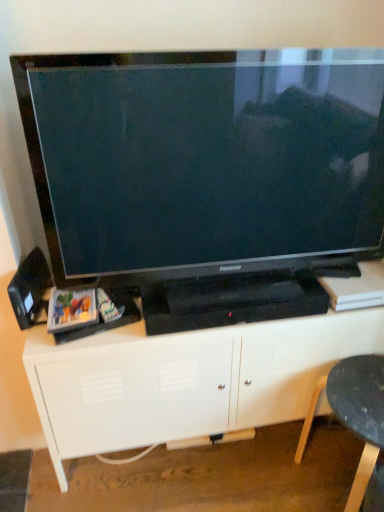
The image size is (384, 512). Find the location of `empty space that is ontop of black plastic chair at lower right (from a real-world perspective)`. empty space that is ontop of black plastic chair at lower right (from a real-world perspective) is located at coordinates (366, 395).